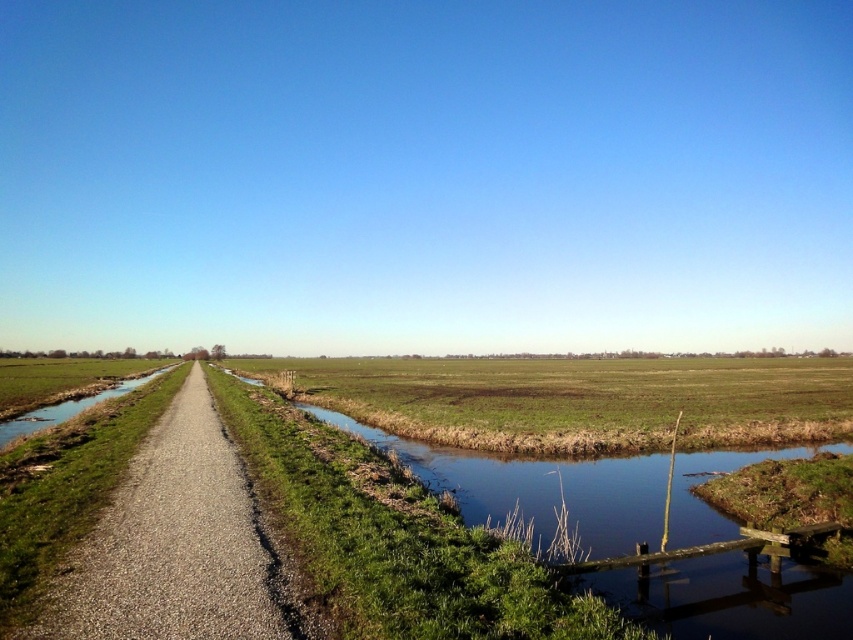
You are a hiker trying to cross from the bottom left to the top right of this rural landscape. You have a map that shows the green grassy stream at center and the gravel road at center. Which path is higher in elevation between the two?

The green grassy stream at center is taller than the gravel road at center, so the green grassy stream at center is higher in elevation.

You are standing at the bottom left corner of the image and want to walk towards the center. Which direction should you head to reach the green grassy field at center before the gravel road at center?

You should head to the right because the green grassy field at center is located to the right of the gravel road at center, so by moving rightward, you can reach the green grassy field before encountering the gravel road.